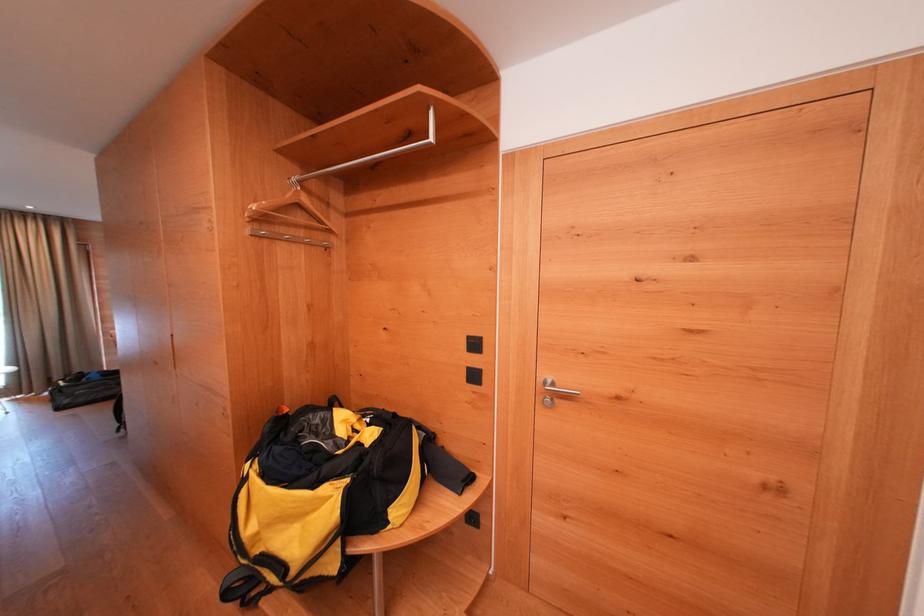
Find the location of a particular element. This screenshot has width=924, height=616. metal coat hook is located at coordinates (289, 238).